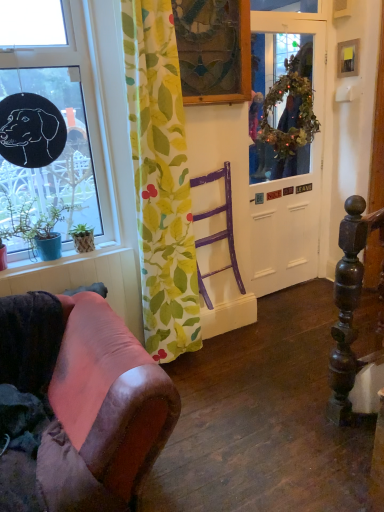
Question: From the image's perspective, is green leafy fabric curtain at center located beneath stained glass picture frame at upper center, arranged as the 2th picture frame when viewed from the right?

Choices:
 (A) no
 (B) yes

Answer: (B)

Question: Considering the relative sizes of green leafy fabric curtain at center and stained glass picture frame at upper center, which is the second picture frame in back-to-front order, in the image provided, is green leafy fabric curtain at center smaller than stained glass picture frame at upper center, which is the second picture frame in back-to-front order,?

Choices:
 (A) no
 (B) yes

Answer: (A)

Question: Is green leafy fabric curtain at center far from stained glass picture frame at upper center, which ranks as the first picture frame in front-to-back order?

Choices:
 (A) no
 (B) yes

Answer: (A)

Question: Can you confirm if green leafy fabric curtain at center is thinner than stained glass picture frame at upper center, which ranks as the first picture frame in front-to-back order?

Choices:
 (A) no
 (B) yes

Answer: (A)

Question: Considering the relative positions of green leafy fabric curtain at center and stained glass picture frame at upper center, which is the second picture frame in back-to-front order, in the image provided, is green leafy fabric curtain at center in front of stained glass picture frame at upper center, which is the second picture frame in back-to-front order,?

Choices:
 (A) no
 (B) yes

Answer: (B)

Question: Is white matte door at center spatially inside black matte window at upper left, or outside of it?

Choices:
 (A) inside
 (B) outside

Answer: (B)

Question: Relative to black matte window at upper left, is white matte door at center in front or behind?

Choices:
 (A) behind
 (B) front

Answer: (A)

Question: Is white matte door at center to the left or to the right of black matte window at upper left in the image?

Choices:
 (A) right
 (B) left

Answer: (A)

Question: Is white matte door at center wider or thinner than black matte window at upper left?

Choices:
 (A) thin
 (B) wide

Answer: (A)

Question: From a real-world perspective, is green leafy wreath at upper right physically located above or below smooth wood window sill at lower left?

Choices:
 (A) above
 (B) below

Answer: (A)

Question: Based on their sizes in the image, would you say green leafy wreath at upper right is bigger or smaller than smooth wood window sill at lower left?

Choices:
 (A) big
 (B) small

Answer: (A)

Question: Considering their positions, is green leafy wreath at upper right located in front of or behind smooth wood window sill at lower left?

Choices:
 (A) front
 (B) behind

Answer: (B)

Question: From the image's perspective, is green leafy wreath at upper right located above or below smooth wood window sill at lower left?

Choices:
 (A) below
 (B) above

Answer: (B)

Question: Is point (160, 203) positioned closer to the camera than point (96, 278)?

Choices:
 (A) farther
 (B) closer

Answer: (B)

Question: Relative to smooth wood window sill at lower left, is green leafy fabric curtain at center in front or behind?

Choices:
 (A) behind
 (B) front

Answer: (B)